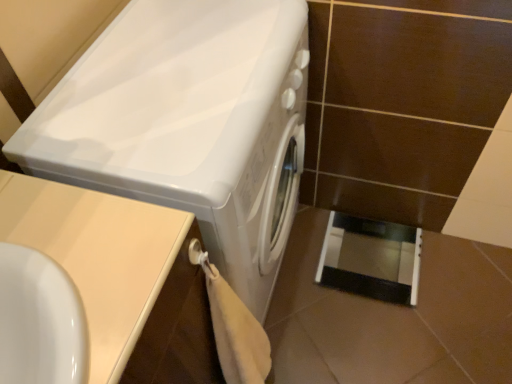
Image resolution: width=512 pixels, height=384 pixels. In order to click on empty space that is ontop of white glossy washing machine at center (from a real-world perspective) in this screenshot , I will do `click(180, 62)`.